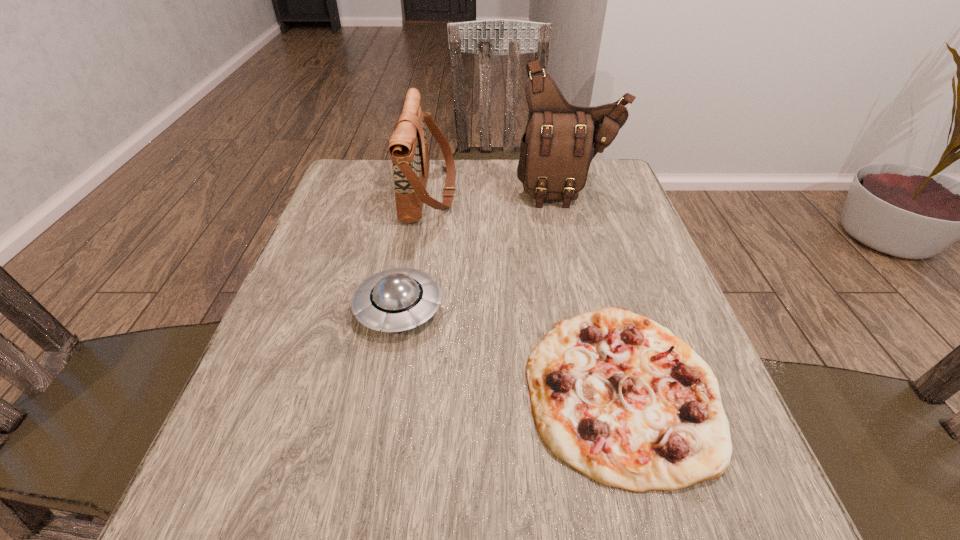
At what (x,y) coordinates should I click in order to perform the action: click on vacant space that satisfies the following two spatial constraints: 1. on the front-facing side of the taller shoulder bag; 2. on the right side of the shortest object. Please return your answer as a coordinate pair (x, y). Looking at the image, I should click on (x=621, y=389).

Locate an element on the screen. free location that satisfies the following two spatial constraints: 1. on the front-facing side of the shorter shoulder bag; 2. on the left side of the pizza is located at coordinates (399, 389).